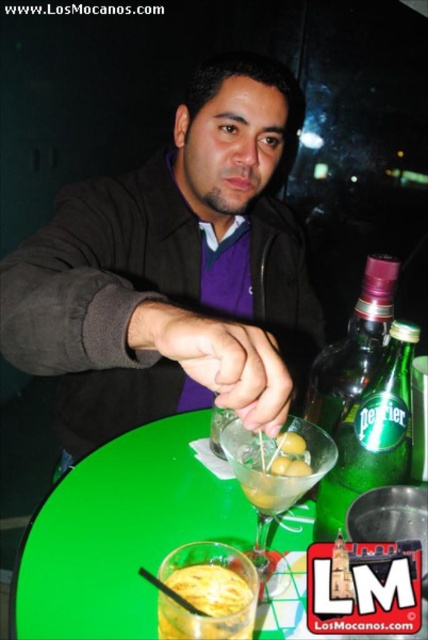
Can you confirm if green plastic table at center is positioned below green glass bottle at right?

Correct, green plastic table at center is located below green glass bottle at right.

Does green plastic table at center appear on the right side of green glass bottle at right?

In fact, green plastic table at center is to the left of green glass bottle at right.

I want to click on green plastic table at center, so coord(121,532).

Locate an element on the screen. The width and height of the screenshot is (428, 640). green plastic table at center is located at coordinates (121, 532).

Who is taller, green glass bottle at center or transparent glass martini at center?

With more height is green glass bottle at center.

Which is more to the left, green glass bottle at center or transparent glass martini at center?

transparent glass martini at center is more to the left.

Based on the photo, who is more distant from viewer, (323,506) or (262,477)?

Point (323,506)

Image resolution: width=428 pixels, height=640 pixels. Identify the location of green glass bottle at center. (371, 435).

Does matte black jacket at center appear on the right side of green glass bottle at center?

Incorrect, matte black jacket at center is not on the right side of green glass bottle at center.

Which is in front, point (122, 237) or point (365, 394)?

Point (365, 394) is in front.

Measure the distance between point [136,212] and camera.

Point [136,212] is 36.10 inches away from camera.

Where is `matte black jacket at center`? The height and width of the screenshot is (640, 428). matte black jacket at center is located at coordinates (172, 272).